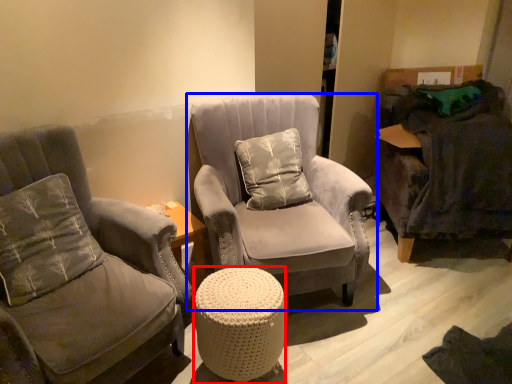
Question: Which object is further to the camera taking this photo, table (highlighted by a red box) or chair (highlighted by a blue box)?

Choices:
 (A) table
 (B) chair

Answer: (B)